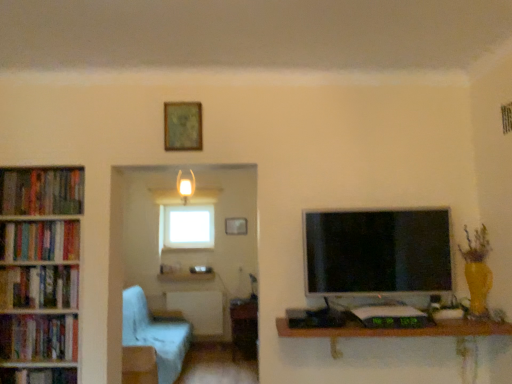
Question: Can you confirm if wooden table at center, the 1th table viewed from the left, is positioned to the left of hardcover books at left, which appears as the 1th book when viewed from the top?

Choices:
 (A) yes
 (B) no

Answer: (B)

Question: Considering the relative sizes of wooden table at center, marked as the second table in a right-to-left arrangement, and hardcover books at left, the fifth book ordered from the bottom, in the image provided, is wooden table at center, marked as the second table in a right-to-left arrangement, taller than hardcover books at left, the fifth book ordered from the bottom,?

Choices:
 (A) no
 (B) yes

Answer: (B)

Question: Could hardcover books at left, the fifth book ordered from the bottom, be considered to be inside wooden table at center, the 1th table viewed from the left?

Choices:
 (A) yes
 (B) no

Answer: (B)

Question: Is wooden table at center, which is the 2th table in top-to-bottom order, facing towards hardcover books at left, which appears as the 1th book when viewed from the top?

Choices:
 (A) yes
 (B) no

Answer: (A)

Question: Is wooden table at center, the 1th table from the back, wider than hardcover books at left, the fifth book ordered from the bottom?

Choices:
 (A) yes
 (B) no

Answer: (A)

Question: Is matte white desk at center to the left or to the right of wooden picture frame at center, which appears as the 2th picture frame when viewed from the front, in the image?

Choices:
 (A) left
 (B) right

Answer: (A)

Question: Is matte white desk at center wider or thinner than wooden picture frame at center, which appears as the first picture frame when viewed from the back?

Choices:
 (A) wide
 (B) thin

Answer: (A)

Question: Is matte white desk at center inside or outside of wooden picture frame at center, which appears as the first picture frame when viewed from the back?

Choices:
 (A) inside
 (B) outside

Answer: (B)

Question: Is point (186, 279) closer or farther from the camera than point (230, 223)?

Choices:
 (A) closer
 (B) farther

Answer: (A)

Question: Is wooden picture frame at center, positioned as the 2th picture frame in top-to-bottom order, bigger or smaller than hardcover books at left, arranged as the 2th book when viewed from the top?

Choices:
 (A) big
 (B) small

Answer: (B)

Question: Is wooden picture frame at center, positioned as the 2th picture frame in top-to-bottom order, taller or shorter than hardcover books at left, the fourth book in the bottom-to-top sequence?

Choices:
 (A) tall
 (B) short

Answer: (A)

Question: In the image, is wooden picture frame at center, positioned as the 2th picture frame in top-to-bottom order, positioned in front of or behind hardcover books at left, arranged as the 2th book when viewed from the top?

Choices:
 (A) behind
 (B) front

Answer: (A)

Question: In terms of width, does wooden picture frame at center, which appears as the 2th picture frame when viewed from the front, look wider or thinner when compared to hardcover books at left, arranged as the 2th book when viewed from the top?

Choices:
 (A) wide
 (B) thin

Answer: (B)

Question: Would you say hardcover books at left, acting as the 4th book starting from the top, is inside or outside wooden picture frame at center, the first picture frame when ordered from bottom to top?

Choices:
 (A) outside
 (B) inside

Answer: (A)

Question: Is point (38, 360) positioned closer to the camera than point (243, 221)?

Choices:
 (A) farther
 (B) closer

Answer: (B)